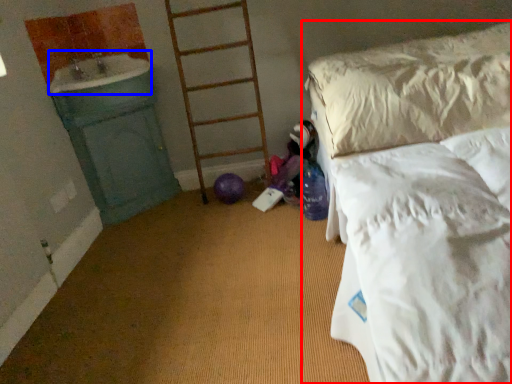
Question: Which of the following is the farthest to the observer, bed (highlighted by a red box) or sink (highlighted by a blue box)?

Choices:
 (A) bed
 (B) sink

Answer: (B)